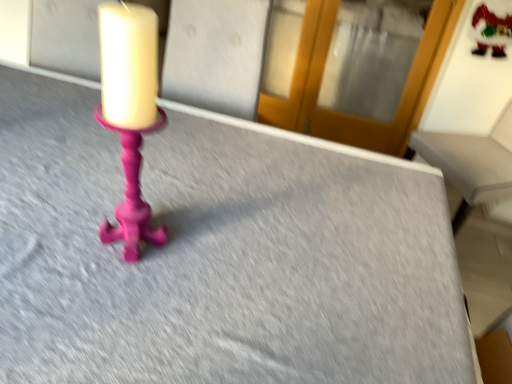
Where is `transparent glass door at upper center`? This screenshot has width=512, height=384. transparent glass door at upper center is located at coordinates (340, 112).

Describe the element at coordinates (340, 112) in the screenshot. The image size is (512, 384). I see `transparent glass door at upper center` at that location.

The width and height of the screenshot is (512, 384). Describe the element at coordinates (492, 27) in the screenshot. I see `frosted glass santa claus at upper right` at that location.

Where is `frosted glass santa claus at upper right`? The height and width of the screenshot is (384, 512). frosted glass santa claus at upper right is located at coordinates [492, 27].

I want to click on transparent glass door at upper center, so click(x=340, y=112).

Which is more to the left, frosted glass santa claus at upper right or transparent glass door at upper center?

transparent glass door at upper center.

Which object is further away from the camera, frosted glass santa claus at upper right or transparent glass door at upper center?

transparent glass door at upper center is behind.

Considering the positions of point (503, 53) and point (308, 78), is point (503, 53) closer or farther from the camera than point (308, 78)?

Clearly, point (503, 53) is closer to the camera than point (308, 78).

From the image's perspective, is frosted glass santa claus at upper right over transparent glass door at upper center?

No.

From a real-world perspective, is frosted glass santa claus at upper right below transparent glass door at upper center?

No, from a real-world perspective, frosted glass santa claus at upper right is not beneath transparent glass door at upper center.

Which object is wider, frosted glass santa claus at upper right or transparent glass door at upper center?

transparent glass door at upper center.

Considering the sizes of frosted glass santa claus at upper right and transparent glass door at upper center in the image, is frosted glass santa claus at upper right taller or shorter than transparent glass door at upper center?

In the image, frosted glass santa claus at upper right appears to be shorter than transparent glass door at upper center.

Considering the sizes of objects frosted glass santa claus at upper right and transparent glass door at upper center in the image provided, who is bigger, frosted glass santa claus at upper right or transparent glass door at upper center?

transparent glass door at upper center is bigger.

Would you say frosted glass santa claus at upper right is outside transparent glass door at upper center?

frosted glass santa claus at upper right lies outside transparent glass door at upper center's area.

Is frosted glass santa claus at upper right next to transparent glass door at upper center?

frosted glass santa claus at upper right and transparent glass door at upper center are clearly separated.

Is frosted glass santa claus at upper right oriented towards transparent glass door at upper center?

No, frosted glass santa claus at upper right does not turn towards transparent glass door at upper center.

What's the angular difference between frosted glass santa claus at upper right and transparent glass door at upper center's facing directions?

They differ by 177 degrees in their facing directions.

Measure the distance from frosted glass santa claus at upper right to transparent glass door at upper center.

They are 24.20 inches apart.

I want to click on santa claus in front of the transparent glass door at upper center, so click(492, 27).

Considering the relative positions of transparent glass door at upper center and frosted glass santa claus at upper right in the image provided, is transparent glass door at upper center to the right of frosted glass santa claus at upper right from the viewer's perspective?

No, transparent glass door at upper center is not to the right of frosted glass santa claus at upper right.

Is transparent glass door at upper center in front of frosted glass santa claus at upper right?

No, transparent glass door at upper center is behind frosted glass santa claus at upper right.

Is point (298, 105) less distant than point (507, 11)?

That is False.

Consider the image. From the image's perspective, is transparent glass door at upper center under frosted glass santa claus at upper right?

Actually, transparent glass door at upper center appears above frosted glass santa claus at upper right in the image.

From a real-world perspective, is transparent glass door at upper center on top of frosted glass santa claus at upper right?

Actually, transparent glass door at upper center is physically below frosted glass santa claus at upper right in the real world.

Does transparent glass door at upper center have a greater width compared to frosted glass santa claus at upper right?

Yes.

Considering the sizes of objects transparent glass door at upper center and frosted glass santa claus at upper right in the image provided, who is shorter, transparent glass door at upper center or frosted glass santa claus at upper right?

frosted glass santa claus at upper right is shorter.

Which of these two, transparent glass door at upper center or frosted glass santa claus at upper right, is smaller?

With smaller size is frosted glass santa claus at upper right.

Could frosted glass santa claus at upper right be considered to be inside transparent glass door at upper center?

Actually, frosted glass santa claus at upper right is outside transparent glass door at upper center.

Is transparent glass door at upper center positioned far away from frosted glass santa claus at upper right?

They are positioned close to each other.

Is transparent glass door at upper center oriented towards frosted glass santa claus at upper right?

No, transparent glass door at upper center does not turn towards frosted glass santa claus at upper right.

How far apart are transparent glass door at upper center and frosted glass santa claus at upper right?

24.20 inches.

You are a GUI agent. You are given a task and a screenshot of the screen. Output one action in this format:
    pyautogui.click(x=<x>, y=<y>)
    Task: Click on the santa claus in front of the transparent glass door at upper center
    The height and width of the screenshot is (384, 512).
    Given the screenshot: What is the action you would take?
    pyautogui.click(x=492, y=27)

Locate an element on the screen. The width and height of the screenshot is (512, 384). santa claus that appears above the transparent glass door at upper center (from a real-world perspective) is located at coordinates (492, 27).

Find the location of a particular element. Image resolution: width=512 pixels, height=384 pixels. glass door located underneath the frosted glass santa claus at upper right (from a real-world perspective) is located at coordinates (340, 112).